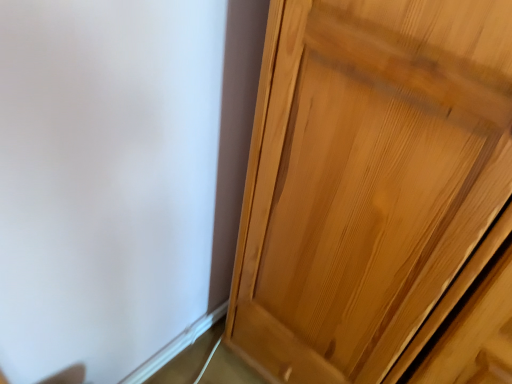
The height and width of the screenshot is (384, 512). Describe the element at coordinates (367, 179) in the screenshot. I see `natural wood door at right` at that location.

You are a GUI agent. You are given a task and a screenshot of the screen. Output one action in this format:
    pyautogui.click(x=<x>, y=<y>)
    Task: Click on the natural wood door at right
    The width and height of the screenshot is (512, 384).
    Given the screenshot: What is the action you would take?
    pyautogui.click(x=367, y=179)

You are a GUI agent. You are given a task and a screenshot of the screen. Output one action in this format:
    pyautogui.click(x=<x>, y=<y>)
    Task: Click on the natural wood door at right
    Image resolution: width=512 pixels, height=384 pixels.
    Given the screenshot: What is the action you would take?
    pyautogui.click(x=367, y=179)